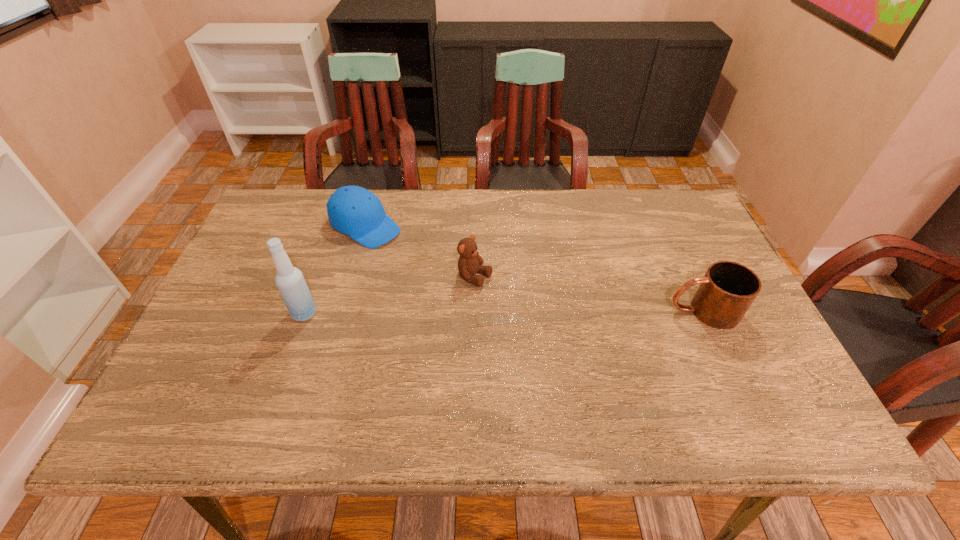
Locate an element on the screen. Image resolution: width=960 pixels, height=540 pixels. free region located on the front-facing side of the farthest object is located at coordinates (447, 276).

Identify the location of free space located 0.070m on the front-facing side of the farthest object. (407, 251).

You are a GUI agent. You are given a task and a screenshot of the screen. Output one action in this format:
    pyautogui.click(x=<x>, y=<y>)
    Task: Click on the free location located on the face of the second farthest object
    
    Given the screenshot: What is the action you would take?
    pyautogui.click(x=529, y=302)

Identify the location of free region located on the face of the second farthest object. Image resolution: width=960 pixels, height=540 pixels. (543, 309).

At what (x,y) coordinates should I click in order to perform the action: click on vacant space situated 0.160m on the face of the second farthest object. Please return your answer as a coordinate pair (x, y). The image size is (960, 540). Looking at the image, I should click on (543, 309).

Identify the location of object that is positioned at the far edge. pos(352,210).

I want to click on object at the right edge, so click(727, 290).

Identify the location of vacant space at the far edge of the desktop. Image resolution: width=960 pixels, height=540 pixels. (326, 202).

The width and height of the screenshot is (960, 540). Identify the location of free space at the near edge of the desktop. (617, 387).

In the image, there is a desktop. Where is `vacant region at the left edge`? vacant region at the left edge is located at coordinates (218, 336).